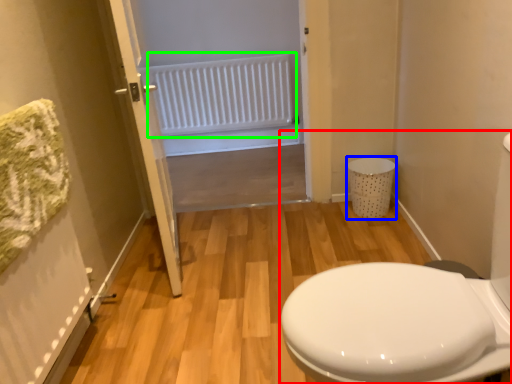
Question: Which object is the farthest from porcelain (highlighted by a red box)? Choose among these: laundry basket (highlighted by a blue box) or radiator (highlighted by a green box).

Choices:
 (A) laundry basket
 (B) radiator

Answer: (B)